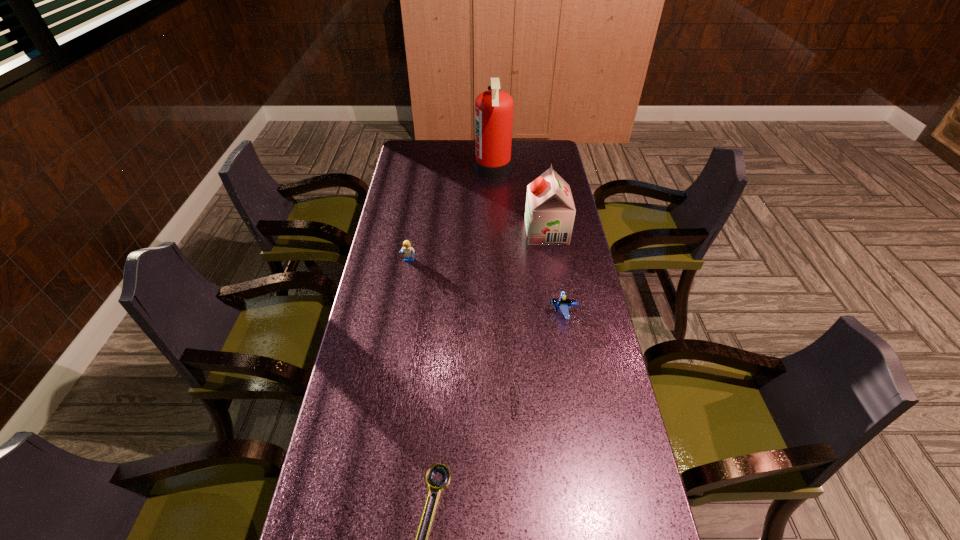
At what (x,y) coordinates should I click in order to perform the action: click on vacant space that satisfies the following two spatial constraints: 1. with the cap open on the fifth nearest object; 2. on the front-facing side of the third farthest object. Please return your answer as a coordinate pair (x, y). The image size is (960, 540). Looking at the image, I should click on (551, 260).